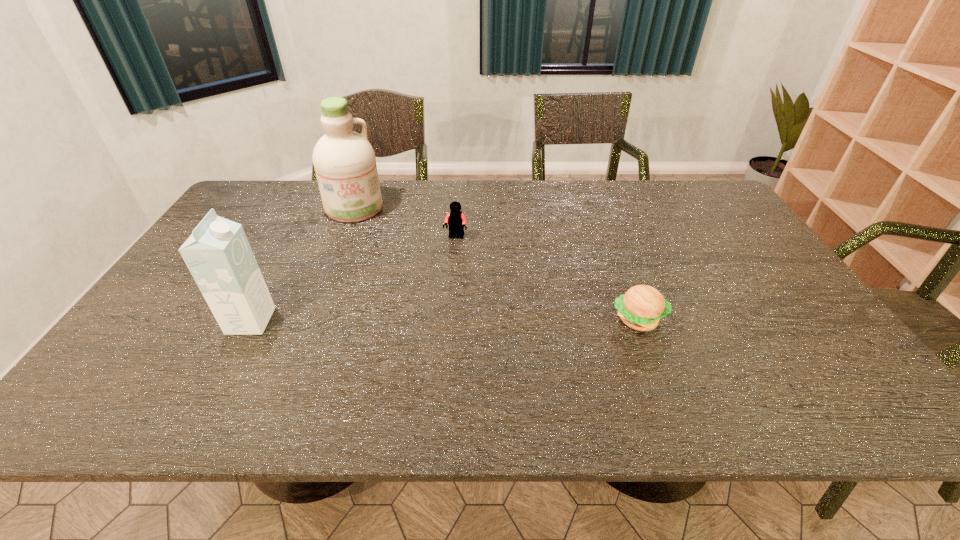
Find the location of a particular element. The width and height of the screenshot is (960, 540). free space on the desktop that is between the carton and the rightmost object and is positioned on the front label of the third object from right to left is located at coordinates (402, 320).

Locate an element on the screen. free space on the desktop that is between the leftmost object and the rightmost object and is positioned on the front-facing side of the third object from left to right is located at coordinates (416, 320).